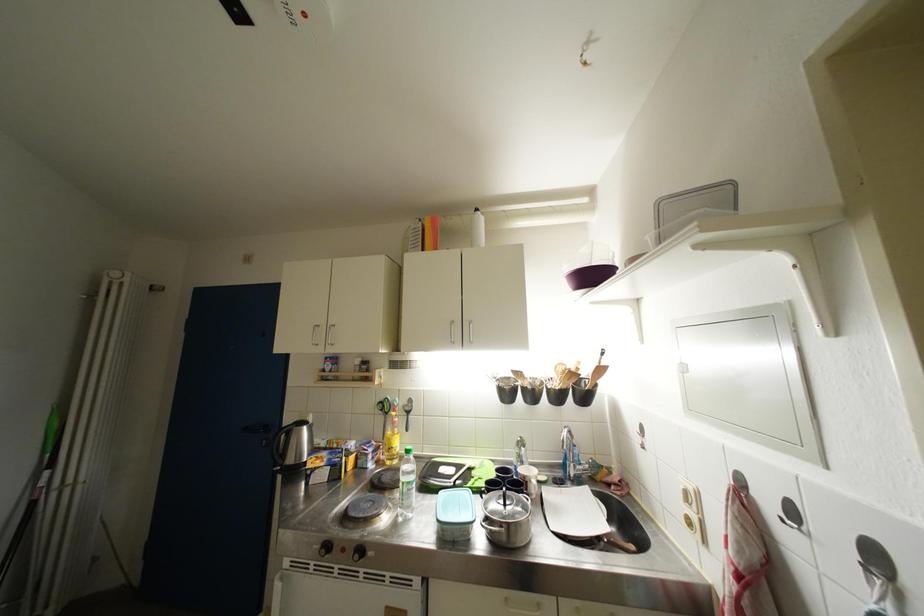
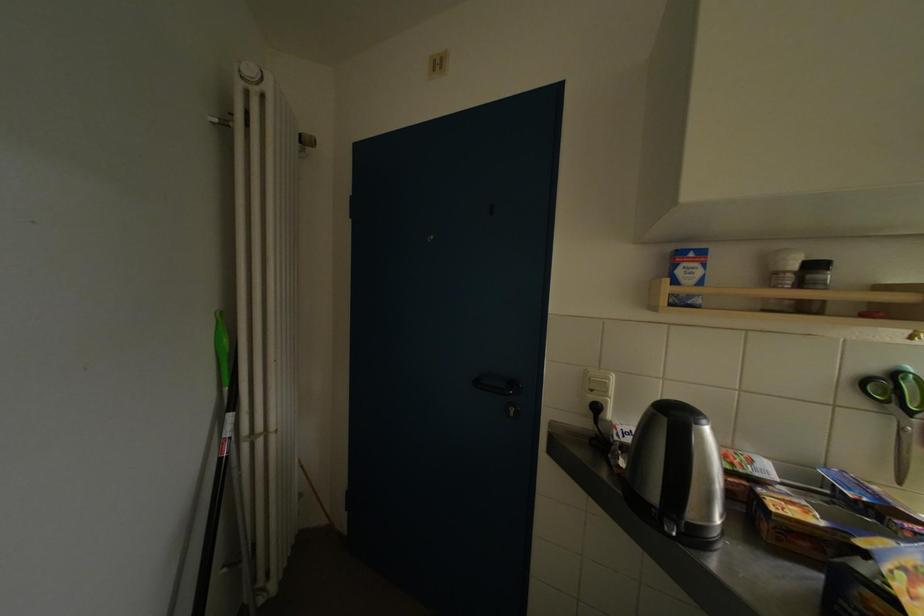
Where in the second image is the point corresponding to point (371, 367) from the first image?

(821, 270)